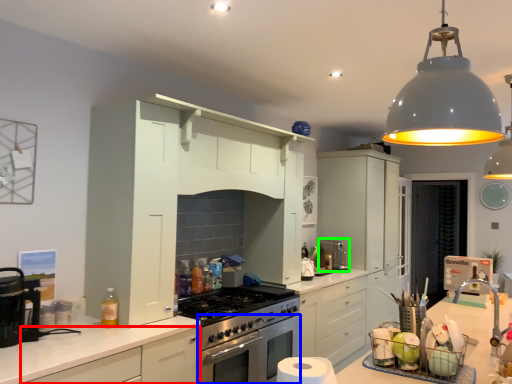
Question: Which object is the closest to the cabinetry (highlighted by a red box)? Choose among these: oven (highlighted by a blue box) or coffee machine (highlighted by a green box).

Choices:
 (A) oven
 (B) coffee machine

Answer: (A)